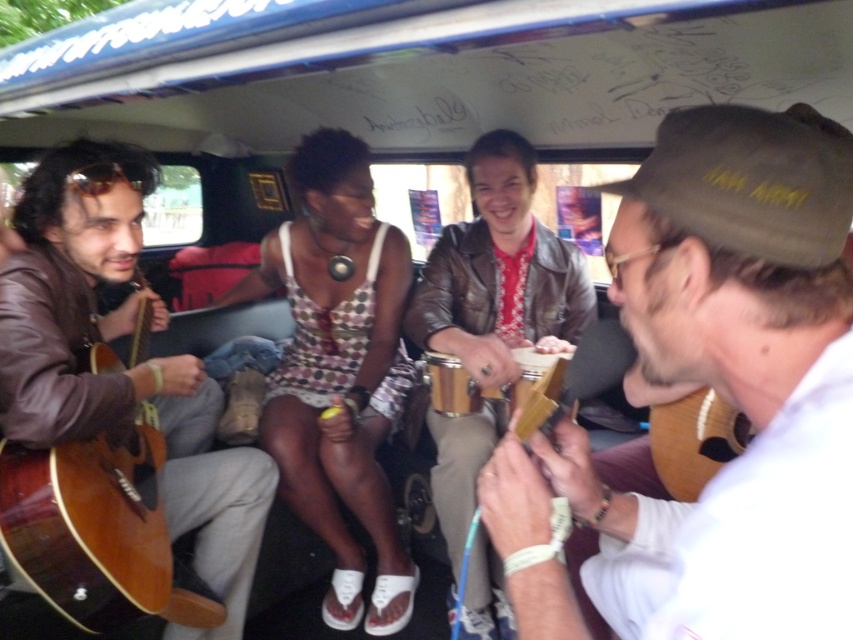
Between leather jacket at center and light brown wooden guitar at lower right, which one appears on the right side from the viewer's perspective?

light brown wooden guitar at lower right is more to the right.

Locate an element on the screen. leather jacket at center is located at coordinates (500, 273).

Is matte brown guitar at center to the right of matte brown guitar at left from the viewer's perspective?

Correct, you'll find matte brown guitar at center to the right of matte brown guitar at left.

Who is lower down, matte brown guitar at center or matte brown guitar at left?

matte brown guitar at left

Image resolution: width=853 pixels, height=640 pixels. What are the coordinates of `matte brown guitar at center` in the screenshot? It's located at (x=720, y=387).

Is point (680, 410) farther from camera compared to point (519, 420)?

Yes, it is behind point (519, 420).

Is light brown wooden guitar at lower right to the right of wooden percussion at center from the viewer's perspective?

Correct, you'll find light brown wooden guitar at lower right to the right of wooden percussion at center.

Does point (680, 420) come behind point (534, 387)?

Yes, it is behind point (534, 387).

At what (x,y) coordinates should I click in order to perform the action: click on light brown wooden guitar at lower right. Please return your answer as a coordinate pair (x, y). This screenshot has height=640, width=853. Looking at the image, I should click on (694, 440).